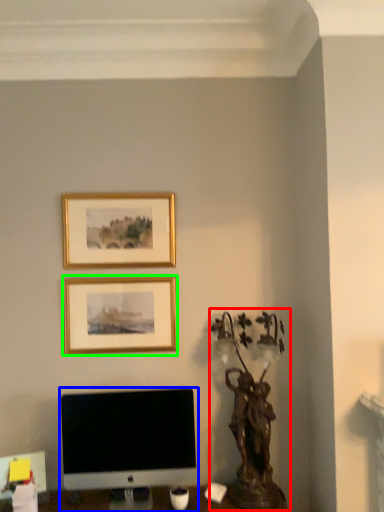
Question: Estimate the real-world distances between objects in this image. Which object is closer to bronze statue (highlighted by a red box), computer monitor (highlighted by a blue box) or picture frame (highlighted by a green box)?

Choices:
 (A) computer monitor
 (B) picture frame

Answer: (A)